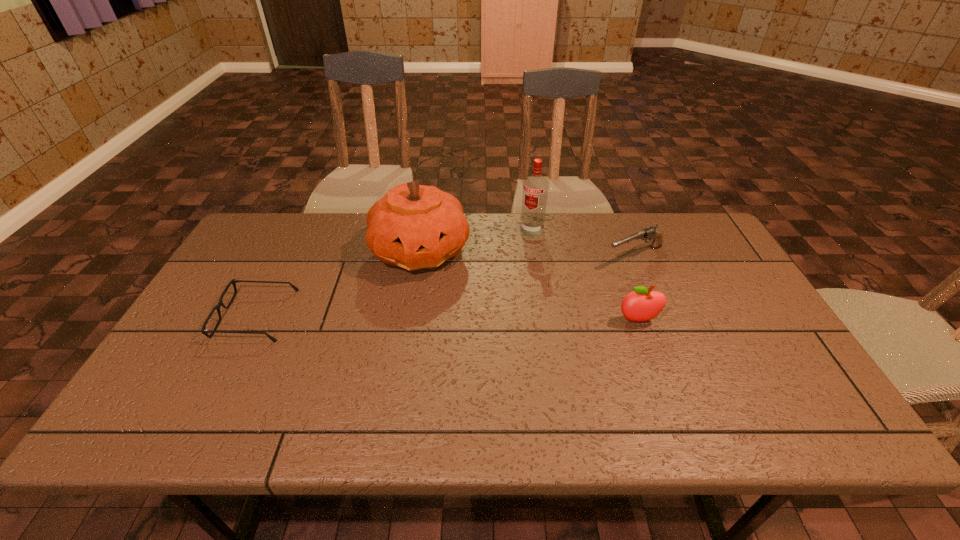
Locate an element on the screen. free spot on the desktop that is between the shortest object and the third shortest object and is positioned aiming along the barrel of the gun is located at coordinates (495, 318).

Image resolution: width=960 pixels, height=540 pixels. Identify the location of free spot on the desktop that is between the spectacles and the apple and is positioned on the front-facing side of the second object from left to right. (471, 318).

Locate an element on the screen. The image size is (960, 540). vacant space on the desktop that is between the spectacles and the third shortest object and is positioned on the front label of the vodka is located at coordinates (473, 318).